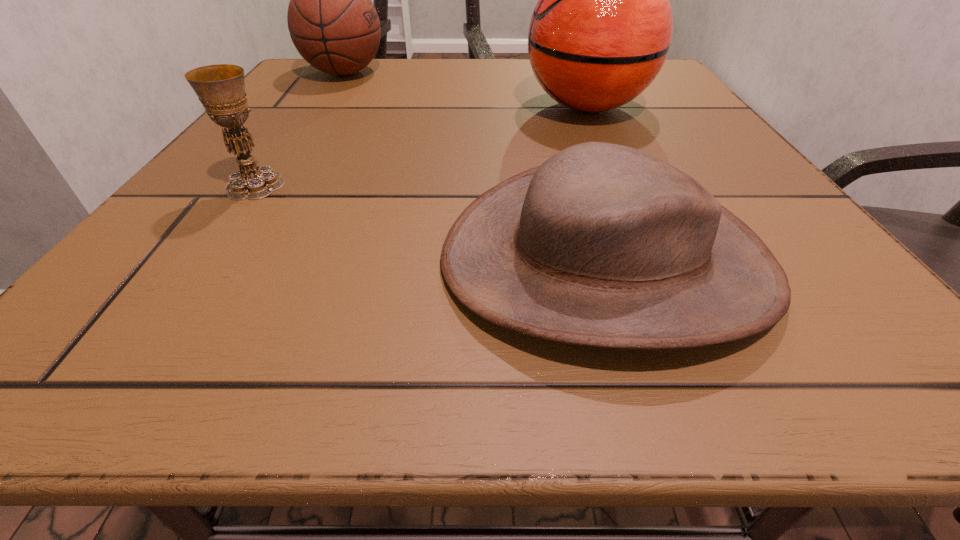
At what (x,y) coordinates should I click in order to perform the action: click on the taller basketball. Please return your answer as a coordinate pair (x, y). Looking at the image, I should click on (600, 33).

The width and height of the screenshot is (960, 540). I want to click on the tallest object, so click(x=600, y=33).

You are a GUI agent. You are given a task and a screenshot of the screen. Output one action in this format:
    pyautogui.click(x=<x>, y=<y>)
    Task: Click on the left basketball
    The image size is (960, 540).
    Given the screenshot: What is the action you would take?
    pyautogui.click(x=333, y=24)

Locate an element on the screen. This screenshot has height=540, width=960. the second shortest object is located at coordinates (220, 88).

Find the location of a particular element. This screenshot has width=960, height=540. cowboy hat is located at coordinates (603, 245).

At what (x,y) coordinates should I click in order to perform the action: click on vacant space situated on the side with spill of the right basketball. Please return your answer as a coordinate pair (x, y). The width and height of the screenshot is (960, 540). Looking at the image, I should click on (330, 107).

The image size is (960, 540). In order to click on vacant area situated 0.240m on the side with spill of the right basketball in this screenshot , I will do `click(401, 107)`.

Where is `vacant area situated on the side with spill of the right basketball`? This screenshot has height=540, width=960. vacant area situated on the side with spill of the right basketball is located at coordinates (401, 107).

Locate an element on the screen. Image resolution: width=960 pixels, height=540 pixels. vacant region located 0.150m on the side with brand label of the shorter basketball is located at coordinates (451, 73).

Find the location of a particular element. The width and height of the screenshot is (960, 540). free location located on the back of the chalice is located at coordinates (307, 111).